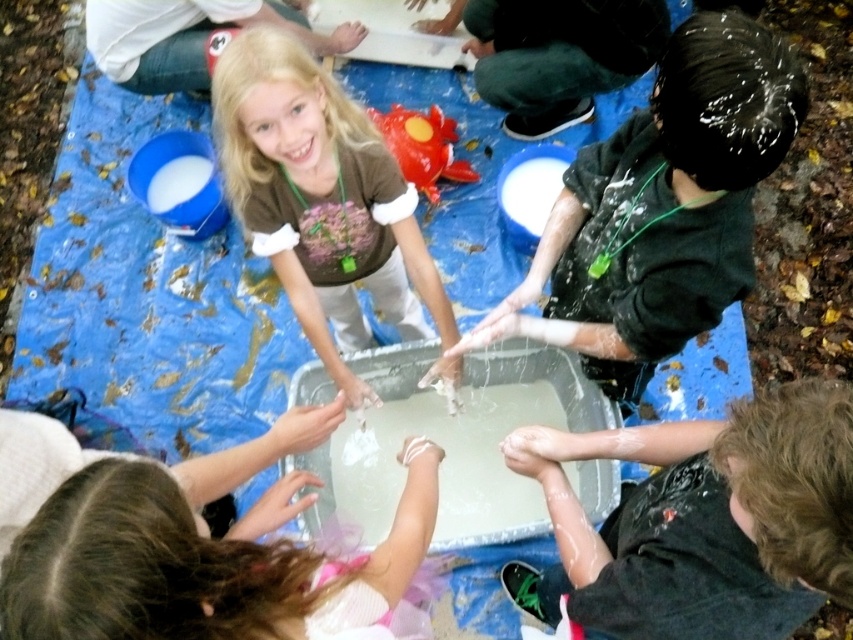
You are a photographer trying to capture a closeup of the white matte hand at lower center without the matte brown shirt at center blocking the view. Is it possible to do so given their sizes?

The matte brown shirt at center is larger in size than the white matte hand at lower center, so it may block the view. To capture a closeup of the white matte hand at lower center without obstruction, you would need to adjust the camera angle or move closer to the hand to ensure the shirt does not cover it.

You are a photographer trying to capture a clear shot of the matte brown shirt at center and the white matte hand at lower center. Which object should you focus on first to ensure both are in focus?

The matte brown shirt at center is closer to you than the white matte hand at lower center, so you should focus on the matte brown shirt at center first to ensure both are in focus.